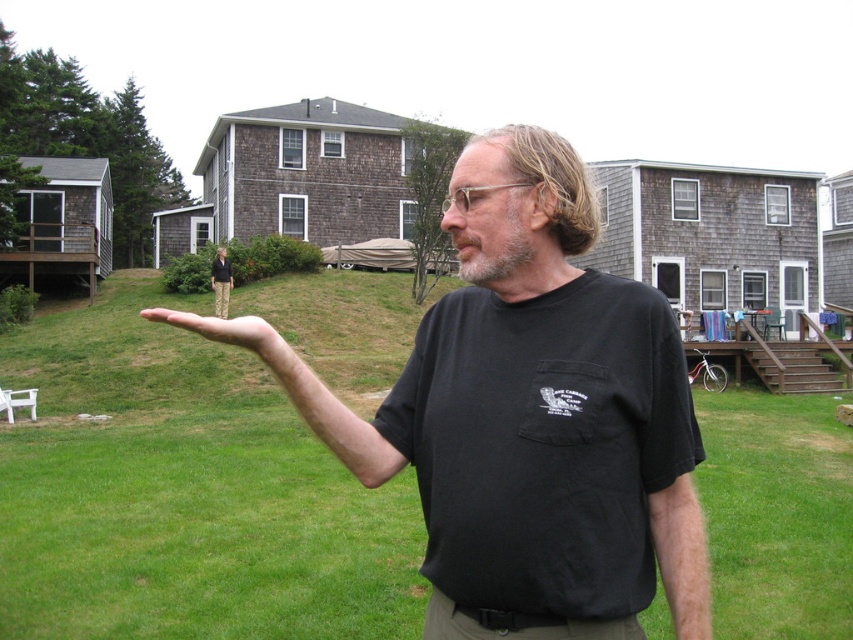
Question: Among these objects, which one is farthest from the camera?

Choices:
 (A) skinny flesh-colored hand at center
 (B) black cotton t-shirt at center

Answer: (B)

Question: Can you confirm if black cotton t-shirt at center is positioned below skinny flesh-colored hand at center?

Choices:
 (A) no
 (B) yes

Answer: (B)

Question: In this image, where is black cotton t-shirt at center located relative to skinny flesh-colored hand at center?

Choices:
 (A) right
 (B) left

Answer: (A)

Question: Among these points, which one is nearest to the camera?

Choices:
 (A) (241, 330)
 (B) (358, 436)

Answer: (A)

Question: Is black cotton t-shirt at center smaller than skinny flesh-colored hand at center?

Choices:
 (A) yes
 (B) no

Answer: (A)

Question: Which object is farther from the camera taking this photo?

Choices:
 (A) black cotton t-shirt at center
 (B) skinny flesh-colored hand at center

Answer: (A)